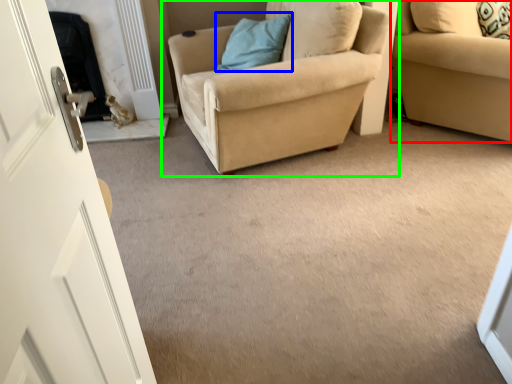
Question: Considering the real-world distances, which object is farthest from studio couch (highlighted by a red box)? pillow (highlighted by a blue box) or chair (highlighted by a green box)?

Choices:
 (A) pillow
 (B) chair

Answer: (A)